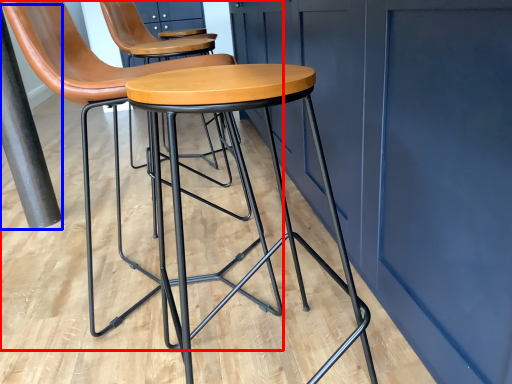
Question: Which of the following is the closest to the observer, chair (highlighted by a red box) or pole (highlighted by a blue box)?

Choices:
 (A) chair
 (B) pole

Answer: (A)